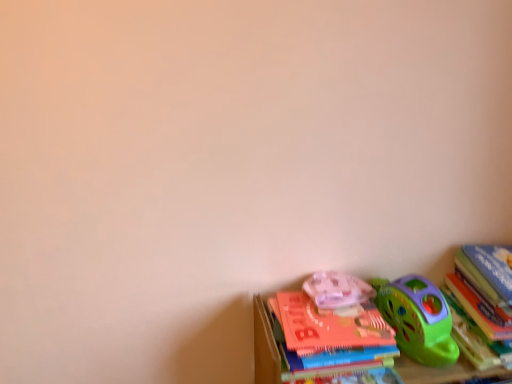
Question: Is translucent plastic toy at lower right located outside hardcover book at right?

Choices:
 (A) yes
 (B) no

Answer: (A)

Question: Is translucent plastic toy at lower right wider than hardcover book at right?

Choices:
 (A) yes
 (B) no

Answer: (B)

Question: Can you confirm if translucent plastic toy at lower right is positioned to the left of hardcover book at right?

Choices:
 (A) yes
 (B) no

Answer: (A)

Question: From the image's perspective, does translucent plastic toy at lower right appear higher than hardcover book at right?

Choices:
 (A) yes
 (B) no

Answer: (A)

Question: Considering the relative sizes of translucent plastic toy at lower right and hardcover book at right in the image provided, is translucent plastic toy at lower right taller than hardcover book at right?

Choices:
 (A) no
 (B) yes

Answer: (A)

Question: Can you confirm if translucent plastic toy at lower right is shorter than hardcover book at right?

Choices:
 (A) yes
 (B) no

Answer: (A)

Question: Can you confirm if hardcover book at right is positioned to the left of translucent plastic toy at lower right?

Choices:
 (A) yes
 (B) no

Answer: (B)

Question: Is hardcover book at right to the right of translucent plastic toy at lower right from the viewer's perspective?

Choices:
 (A) yes
 (B) no

Answer: (A)

Question: Are hardcover book at right and translucent plastic toy at lower right beside each other?

Choices:
 (A) no
 (B) yes

Answer: (A)

Question: Could you tell me if hardcover book at right is turned towards translucent plastic toy at lower right?

Choices:
 (A) yes
 (B) no

Answer: (B)

Question: Is hardcover book at right outside translucent plastic toy at lower right?

Choices:
 (A) no
 (B) yes

Answer: (B)

Question: Considering the relative positions of hardcover book at right and translucent plastic toy at lower right in the image provided, is hardcover book at right behind translucent plastic toy at lower right?

Choices:
 (A) yes
 (B) no

Answer: (B)

Question: Would you say translucent plastic toy at lower right is inside or outside hardcover book at right?

Choices:
 (A) inside
 (B) outside

Answer: (B)